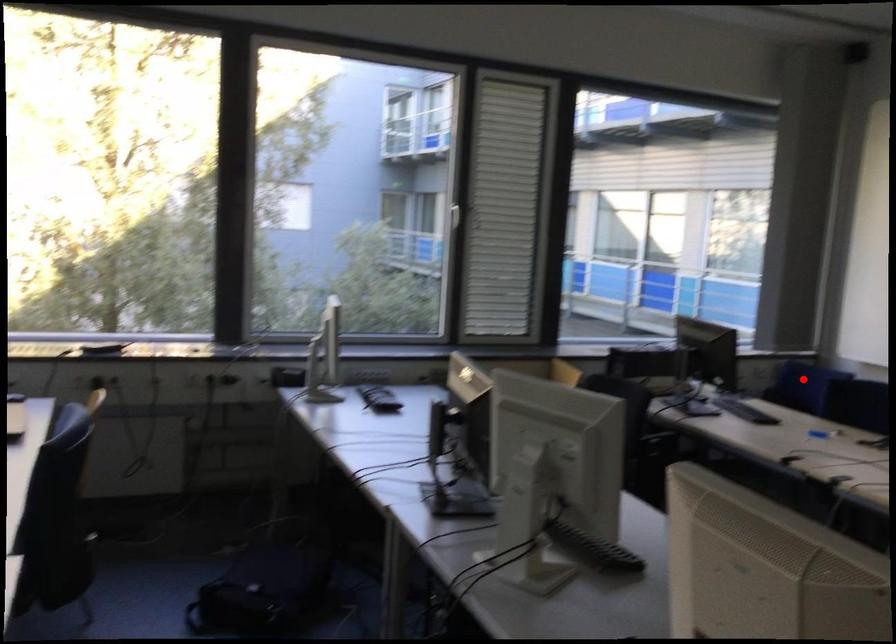
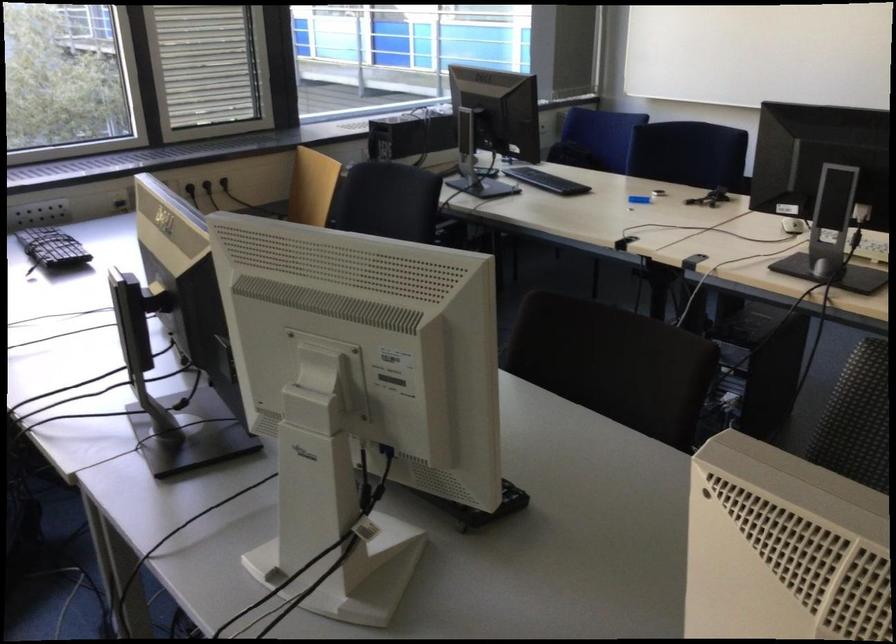
In the second image, find the point that corresponds to the highlighted location in the first image.

(596, 138)